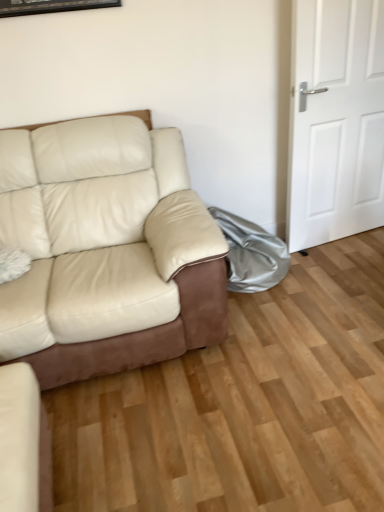
Identify the location of free space in front of beige leather couch at left, marked as the 2th studio couch in a bottom-to-top arrangement. (173, 434).